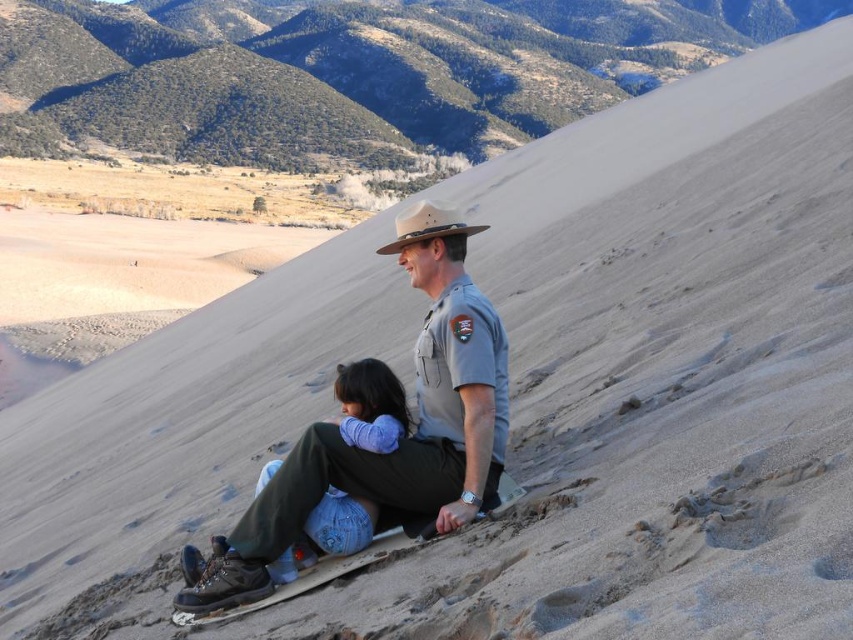
Which is below, gray uniform at center or denim pants at lower center?

Positioned lower is denim pants at lower center.

Who is more forward, (450,364) or (376,436)?

Positioned in front is point (376,436).

This screenshot has width=853, height=640. What are the coordinates of `gray uniform at center` in the screenshot? It's located at (379, 451).

Locate an element on the screen. This screenshot has height=640, width=853. gray uniform at center is located at coordinates (379, 451).

Is gray uniform at center below light brown felt cowboy hat at center?

Yes.

Who is positioned more to the right, gray uniform at center or light brown felt cowboy hat at center?

From the viewer's perspective, gray uniform at center appears more on the right side.

Where is `gray uniform at center`? This screenshot has height=640, width=853. gray uniform at center is located at coordinates (379, 451).

Locate an element on the screen. This screenshot has width=853, height=640. gray uniform at center is located at coordinates (379, 451).

Does denim pants at lower center have a larger size compared to light brown felt cowboy hat at center?

Incorrect, denim pants at lower center is not larger than light brown felt cowboy hat at center.

Who is taller, denim pants at lower center or light brown felt cowboy hat at center?

With more height is light brown felt cowboy hat at center.

Is point (325, 552) closer to camera compared to point (430, 228)?

Yes, it is.

This screenshot has height=640, width=853. In order to click on denim pants at lower center in this screenshot , I will do `click(370, 404)`.